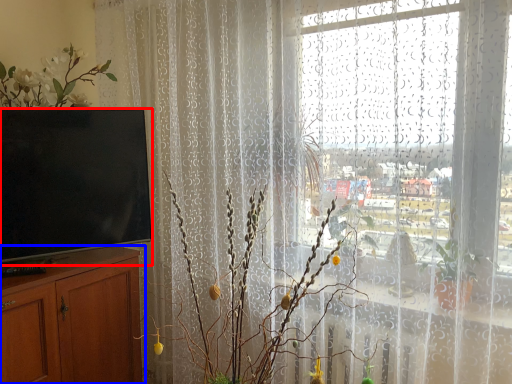
Question: Which object appears farthest to the camera in this image, television (highlighted by a red box) or cabinetry (highlighted by a blue box)?

Choices:
 (A) television
 (B) cabinetry

Answer: (A)